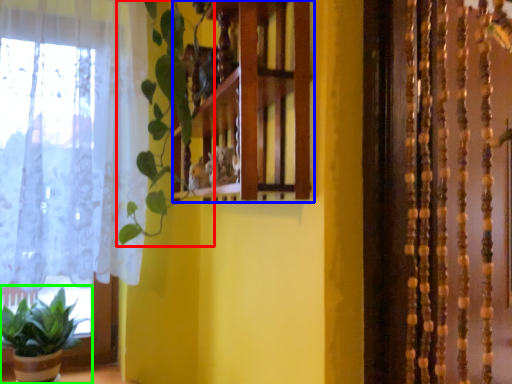
Question: Considering the real-world distances, which object is farthest from vegetation (highlighted by a red box)? shelf (highlighted by a blue box) or houseplant (highlighted by a green box)?

Choices:
 (A) shelf
 (B) houseplant

Answer: (B)